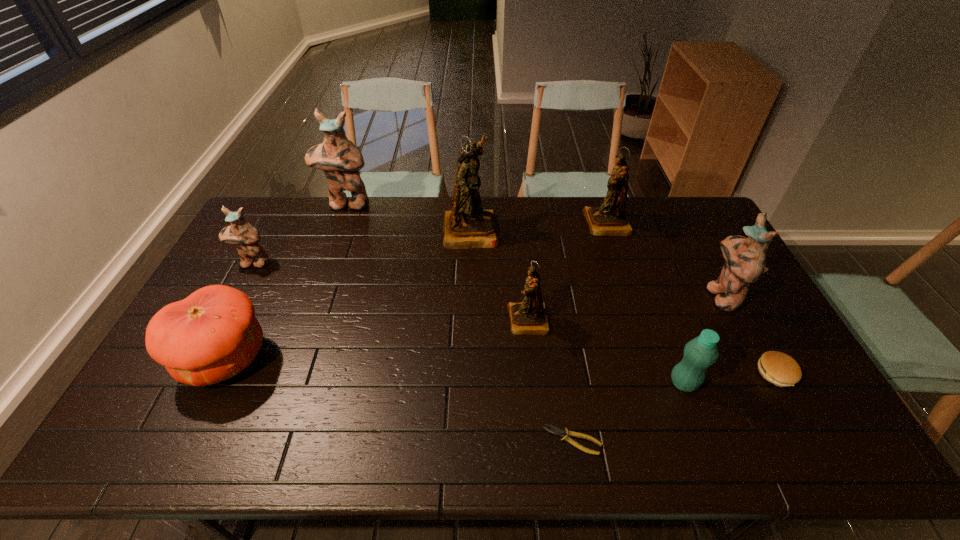
You are a GUI agent. You are given a task and a screenshot of the screen. Output one action in this format:
    pyautogui.click(x=<x>, y=<y>)
    Task: Click on the free space located 0.390m on the front-facing side of the fifth figurine from left to right
    
    Given the screenshot: What is the action you would take?
    pyautogui.click(x=479, y=224)

I want to click on free point located 0.250m on the front-facing side of the fifth figurine from left to right, so tap(516, 224).

Find the location of a particular element. The image size is (960, 540). free space located 0.140m on the front-facing side of the nearest pink figurine is located at coordinates (661, 295).

Locate an element on the screen. This screenshot has height=540, width=960. free point located on the front-facing side of the nearest pink figurine is located at coordinates (629, 295).

Where is `vacant space located on the front-facing side of the nearest pink figurine`? The image size is (960, 540). vacant space located on the front-facing side of the nearest pink figurine is located at coordinates (684, 295).

This screenshot has height=540, width=960. Find the location of `vacant area situated 0.220m on the front-facing side of the second nearest pink figurine`. vacant area situated 0.220m on the front-facing side of the second nearest pink figurine is located at coordinates (222, 322).

Where is `vacant space located 0.100m on the front-facing side of the smallest gold figurine`? Image resolution: width=960 pixels, height=540 pixels. vacant space located 0.100m on the front-facing side of the smallest gold figurine is located at coordinates (473, 321).

Locate an element on the screen. vacant area located on the front-facing side of the smallest gold figurine is located at coordinates (412, 321).

Image resolution: width=960 pixels, height=540 pixels. I want to click on vacant space located on the front-facing side of the smallest gold figurine, so click(x=443, y=321).

The height and width of the screenshot is (540, 960). What are the coordinates of `free spot located 0.220m on the right of the pumpkin` in the screenshot? It's located at (349, 359).